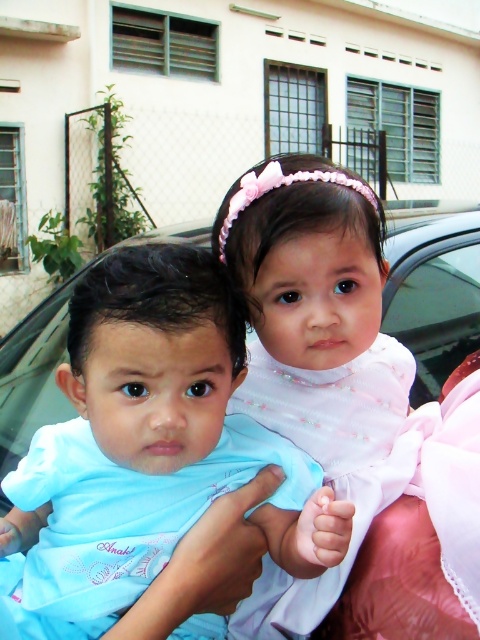
Identify the location of light blue fabric baby at center. (151, 449).

Is light blue fabric baby at center further to camera compared to white satin dress at center?

No, it is in front of white satin dress at center.

Find the location of `light blue fabric baby at center`. light blue fabric baby at center is located at coordinates (151, 449).

Who is positioned more to the left, light blue fabric baby at center or transparent glass car window at right?

Positioned to the left is light blue fabric baby at center.

Does light blue fabric baby at center appear over transparent glass car window at right?

Incorrect, light blue fabric baby at center is not positioned above transparent glass car window at right.

Is point (159, 534) closer to viewer compared to point (469, 244)?

Yes, it is in front of point (469, 244).

The height and width of the screenshot is (640, 480). I want to click on light blue fabric baby at center, so click(x=151, y=449).

Does point (245, 186) come in front of point (433, 292)?

Yes, it is in front of point (433, 292).

Does white satin dress at center appear over transparent glass car window at right?

No.

Measure the distance between white satin dress at center and camera.

The distance of white satin dress at center from camera is 27.82 inches.

Where is `white satin dress at center`? white satin dress at center is located at coordinates (313, 348).